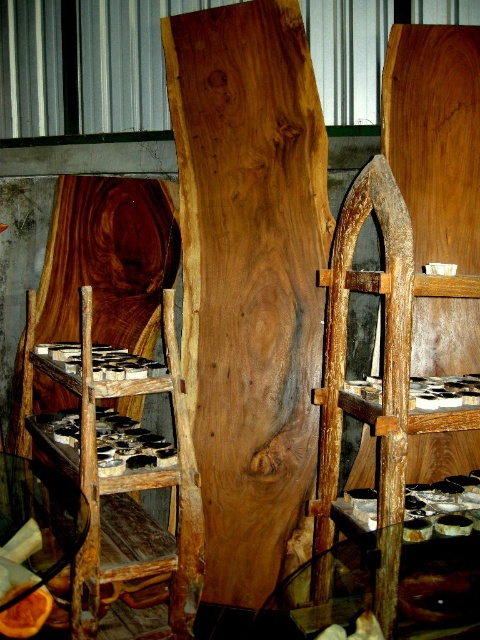
Question: Which point is farther from the camera taking this photo?

Choices:
 (A) (379, 460)
 (B) (123, 548)
 (C) (262, 259)

Answer: (C)

Question: Does rusty wood chair at left appear over rustic wood ladder at center?

Choices:
 (A) yes
 (B) no

Answer: (B)

Question: Can you confirm if rusty wood chair at left is positioned above rustic wood ladder at center?

Choices:
 (A) yes
 (B) no

Answer: (B)

Question: Which of these objects is positioned closest to the rustic wood ladder at center?

Choices:
 (A) natural wood plank at center
 (B) rusty wood chair at left

Answer: (B)

Question: Observing the image, what is the correct spatial positioning of natural wood plank at center in reference to rusty wood chair at left?

Choices:
 (A) right
 (B) left

Answer: (A)

Question: Which point is farther to the camera?

Choices:
 (A) natural wood plank at center
 (B) rusty wood chair at left
 (C) rustic wood ladder at center

Answer: (A)